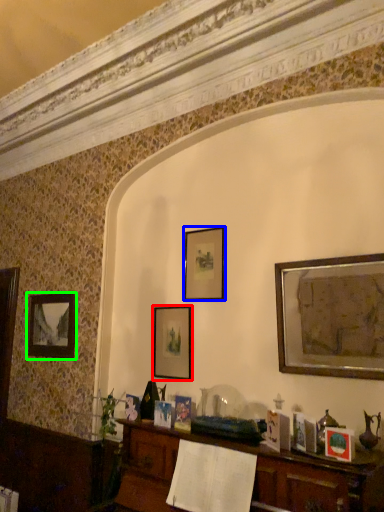
Question: Considering the real-world distances, which object is farthest from picture frame (highlighted by a red box)? picture frame (highlighted by a blue box) or picture frame (highlighted by a green box)?

Choices:
 (A) picture frame
 (B) picture frame

Answer: (B)